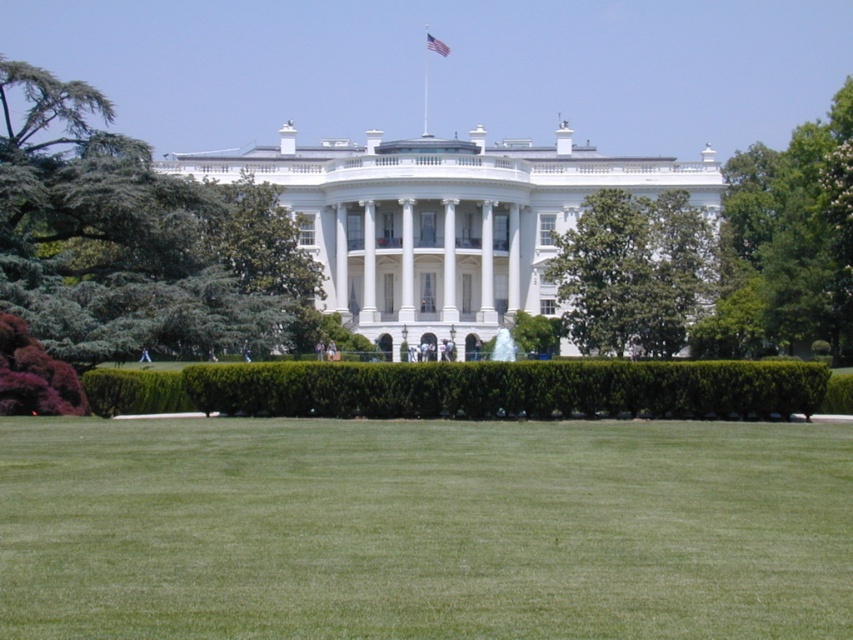
You are a photographer planning to take a picture of the White House. You want to ensure that both the green leafy tree at left and the american flag at upper center are clearly visible in your photo. Based on their sizes, which object would appear larger in the final image?

The green leafy tree at left would appear larger in the final image because it is much taller than the american flag at upper center.

You are standing at the point labeled point [440,52] and want to walk to the point labeled point [316,474]. Given that both points are on the lawn in front of the White House, which direction should you head to reach your destination?

You should head forward because point [316,474] is in front of point [440,52].

You are standing on the lawn in front of the White House and want to take a photo of the metallic flag pole at upper center. To ensure the flag is centered in your photo, where should you position yourself relative to the lawn?

To center the metallic flag pole at upper center in your photo, you should position yourself at the center of the lawn directly in front of the White House, as the flag pole is located at coordinates point (425, 99) which is near the upper center of the image.